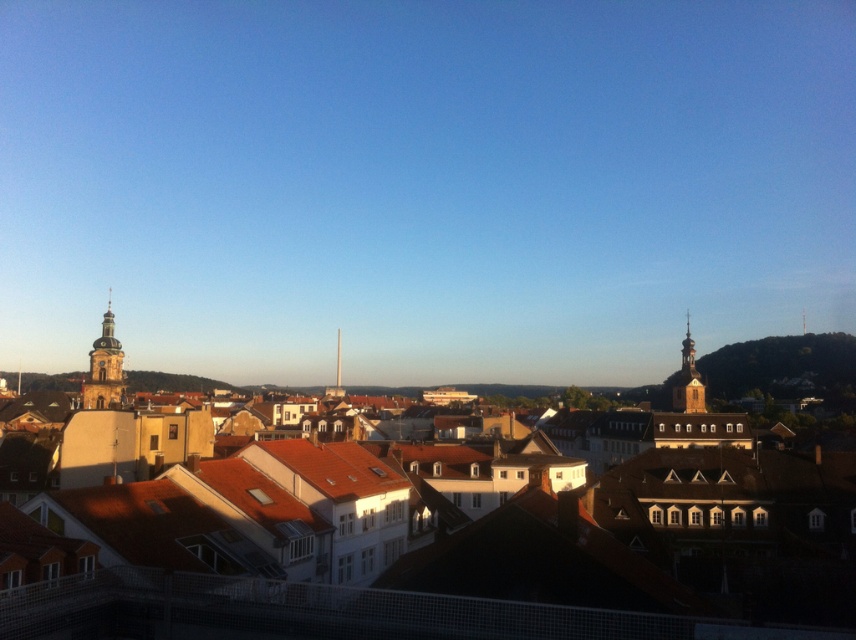
You are standing on a balcony overlooking a European town. You see the brown clay roof tiles at center and the golden stone tower at left. Which object is located to the right of the other?

The brown clay roof tiles at center is positioned on the right side of golden stone tower at left.

You are standing on the balcony of a building overlooking the town. You notice two points marked in the scene. The first point is at coordinates point (134, 547) and the second is at point (698, 381). Which point is closer to your current position?

Point (134, 547) is in front of point (698, 381), so the first point is closer to your current position on the balcony.

You are standing on the balcony and want to locate the golden stone tower at left. According to the coordinates provided, where should you look relative to the center of the image?

The golden stone tower at left is located at coordinates approximately 0.577 on the x axis and 0.123 on the y axis, so you should look slightly to the right and slightly downward from the center of the image to find it.